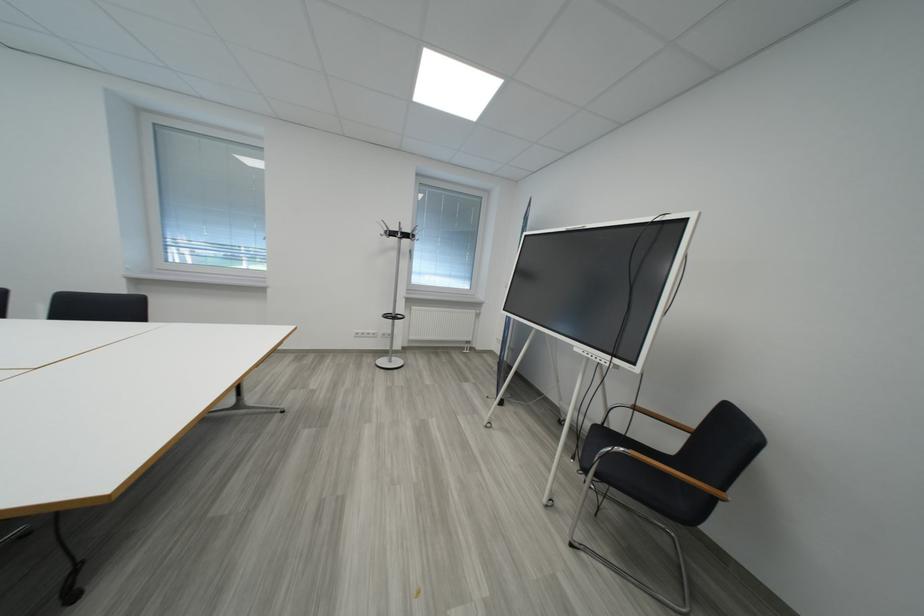
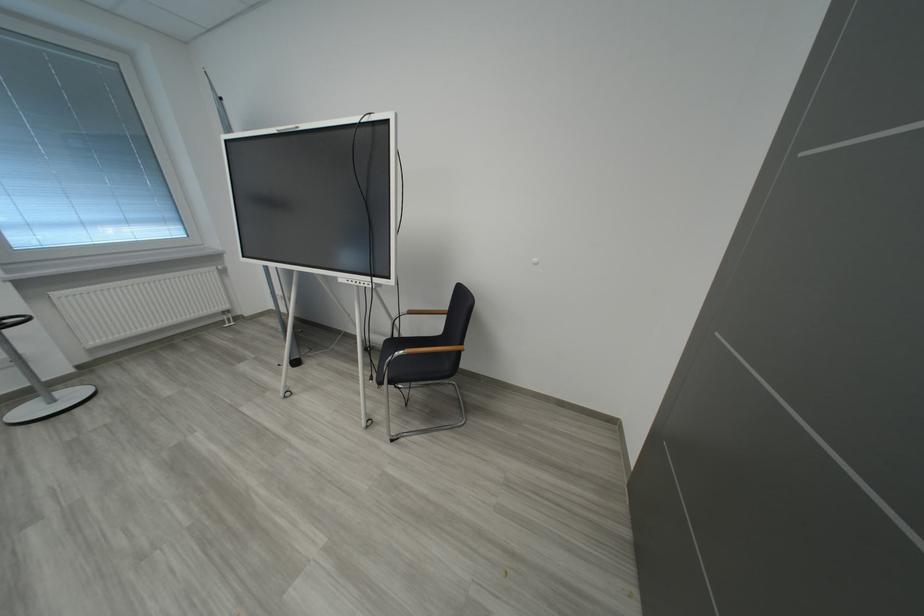
In the second image, find the point that corresponds to [602,429] in the first image.

(394, 344)